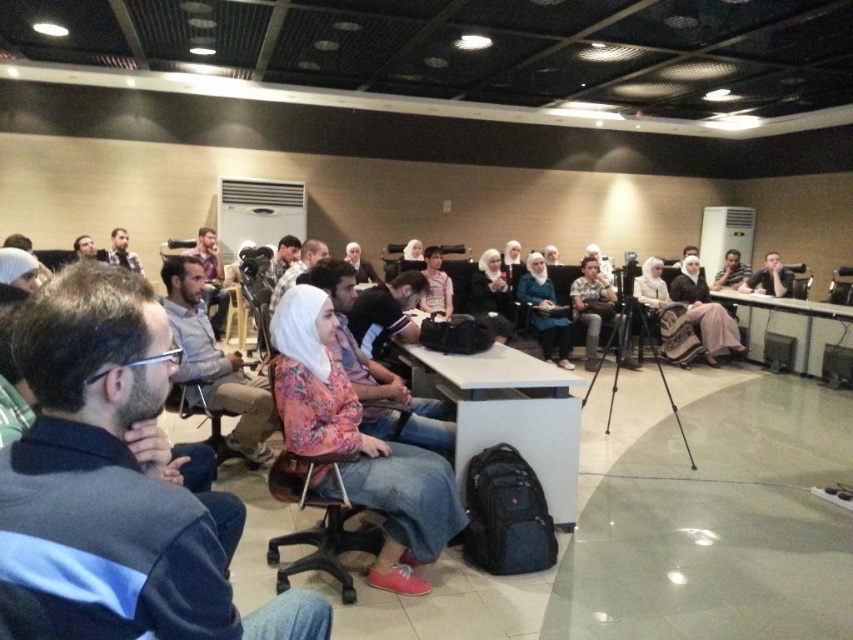
Question: Which point is closer to the camera?

Choices:
 (A) pink fabric shirt at center
 (B) black plastic chair at center
 (C) matte black shirt at center

Answer: (B)

Question: Which point is farther to the camera?

Choices:
 (A) (479, 280)
 (B) (425, 276)

Answer: (A)

Question: Which point appears farthest from the camera in this image?

Choices:
 (A) (370, 552)
 (B) (398, 593)
 (C) (428, 285)

Answer: (C)

Question: Is matte black camera at center below matte black jacket at center?

Choices:
 (A) no
 (B) yes

Answer: (A)

Question: Considering the relative positions of black plastic chair at center and matte black jacket at center in the image provided, where is black plastic chair at center located with respect to matte black jacket at center?

Choices:
 (A) left
 (B) right

Answer: (A)

Question: Can you confirm if matte gray shirt at center is positioned to the right of black plastic chair at center?

Choices:
 (A) no
 (B) yes

Answer: (A)